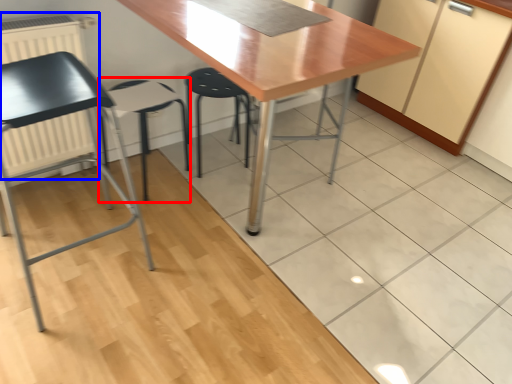
Question: Which of the following is the closest to the observer, folding chair (highlighted by a red box) or radiator (highlighted by a blue box)?

Choices:
 (A) folding chair
 (B) radiator

Answer: (B)